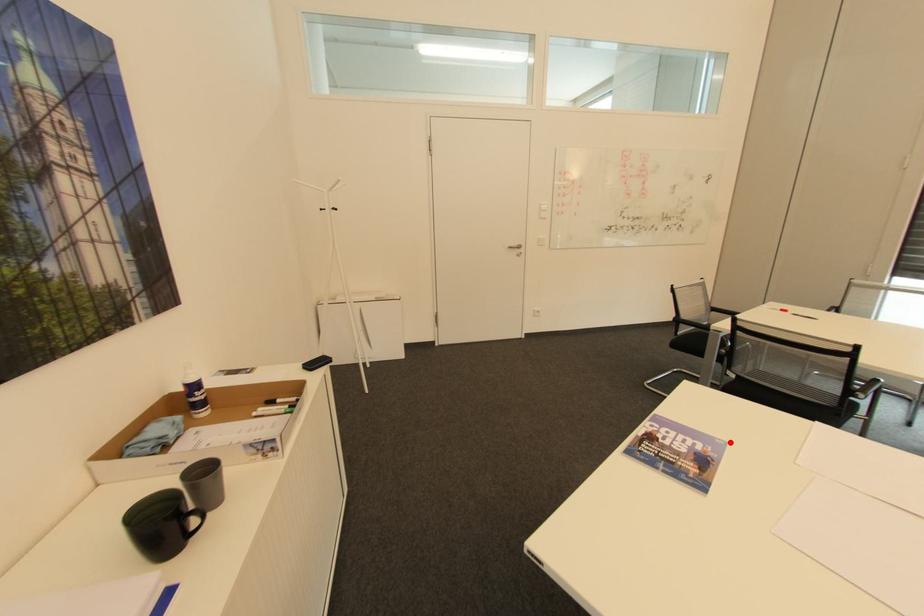
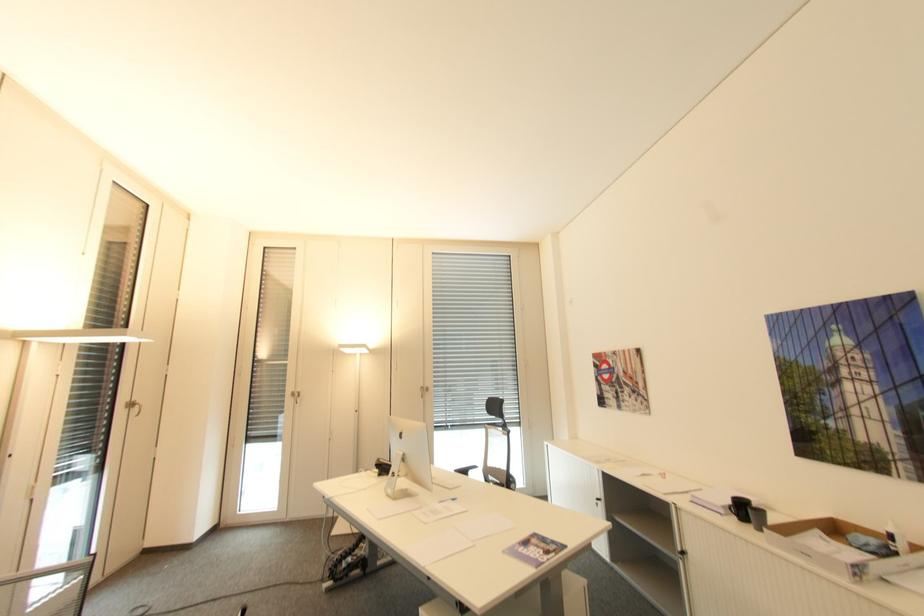
Locate, in the second image, the point that corresponds to the highlighted location in the first image.

(507, 553)